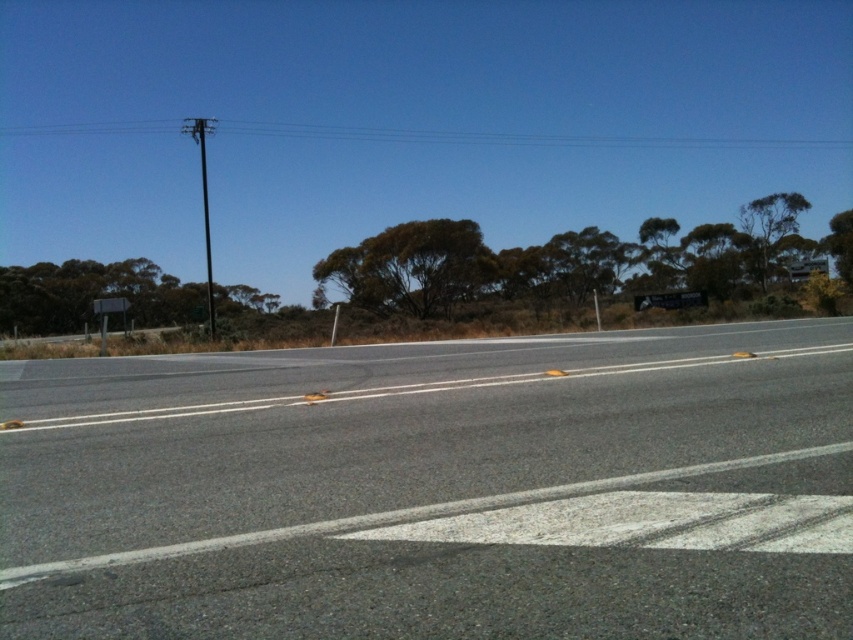
You are a driver approaching the gray asphalt road at center and the black plastic sign at upper right. Which object is closer to the ground?

The gray asphalt road at center has a lesser height compared to the black plastic sign at upper right, so the gray asphalt road at center is closer to the ground.

You are standing at the point marked as point (437, 490). Looking around, you see the gray asphalt road at center. Which direction should you walk to stay on the gray asphalt road at center?

The gray asphalt road at center is located at point (437, 490), so you should walk along the direction of the road to stay on it.